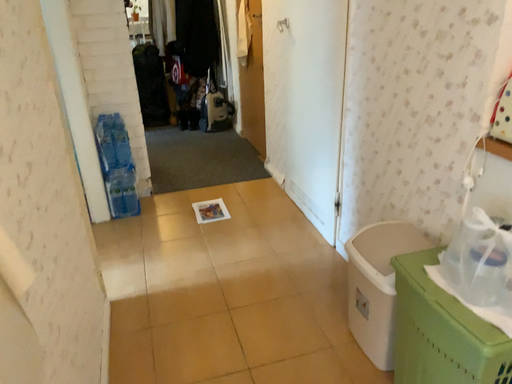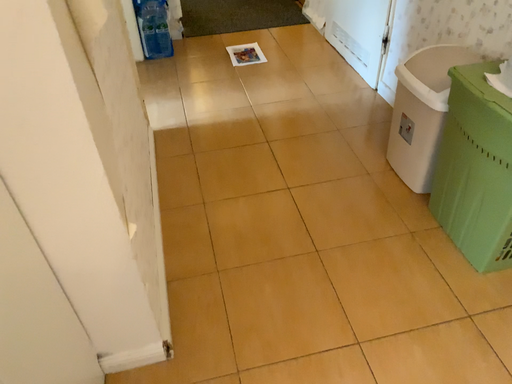
Question: Which way did the camera rotate in the video?

Choices:
 (A) rotated upward
 (B) rotated downward

Answer: (B)